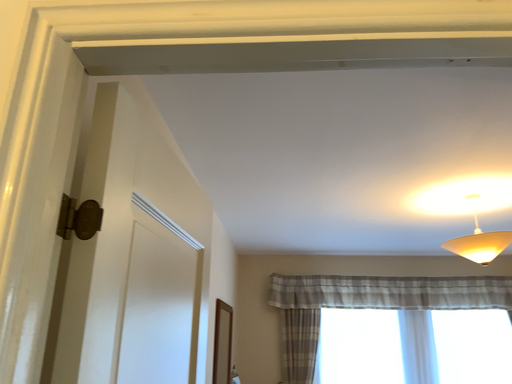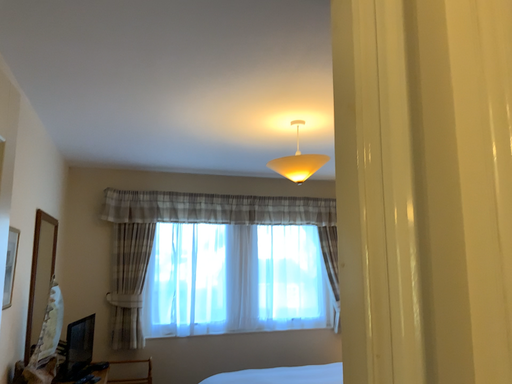
Question: Which way did the camera rotate in the video?

Choices:
 (A) rotated upward
 (B) rotated downward

Answer: (B)